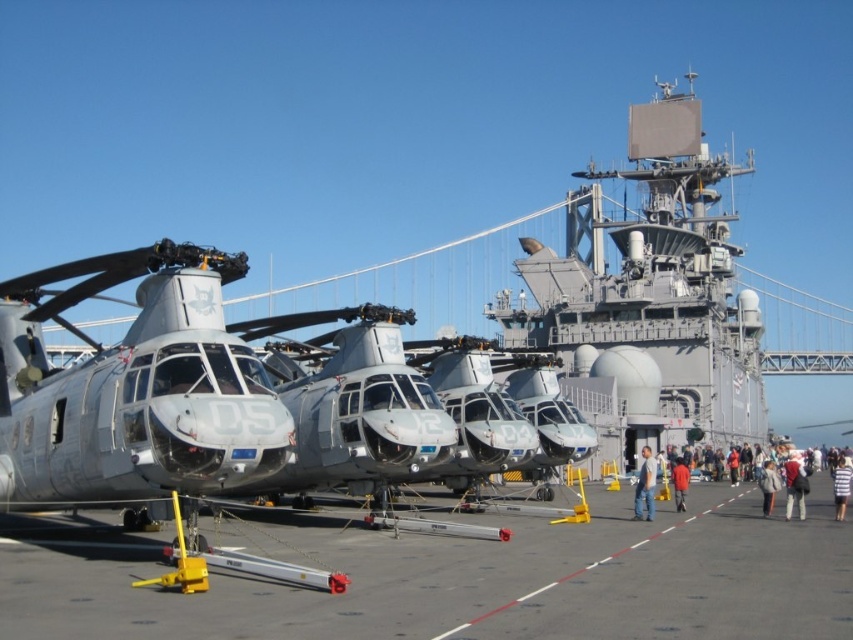
Question: Does matte gray helicopter at left appear on the right side of light blue jeans at center?

Choices:
 (A) yes
 (B) no

Answer: (B)

Question: Is matte gray helicopter at left wider than red fabric jacket at lower right?

Choices:
 (A) no
 (B) yes

Answer: (B)

Question: Which of these objects is positioned closest to the light brown leather jacket at lower right?

Choices:
 (A) red fabric jacket at lower right
 (B) matte gray helicopter at left
 (C) white cotton jacket at lower right
 (D) striped shirt at lower right

Answer: (C)

Question: Which is farther from the striped shirt at lower right?

Choices:
 (A) light blue jeans at lower right
 (B) light brown leather jacket at lower right

Answer: (A)

Question: Which point appears farthest from the camera in this image?

Choices:
 (A) (235, 481)
 (B) (767, 513)
 (C) (799, 509)
 (D) (636, 483)

Answer: (D)

Question: Does smooth gray tarmac at center have a smaller size compared to light brown leather jacket at lower right?

Choices:
 (A) yes
 (B) no

Answer: (B)